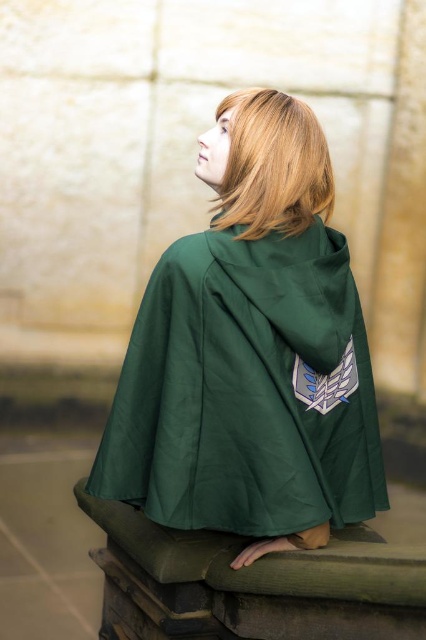
Between green fabric cape at center and blonde silky hair at upper center, which one appears on the left side from the viewer's perspective?

Positioned to the left is green fabric cape at center.

Does green fabric cape at center have a lesser height compared to blonde silky hair at upper center?

No, green fabric cape at center is not shorter than blonde silky hair at upper center.

Does point (278, 237) come in front of point (293, 104)?

Yes, point (278, 237) is in front of point (293, 104).

At what (x,y) coordinates should I click in order to perform the action: click on green fabric cape at center. Please return your answer as a coordinate pair (x, y). Looking at the image, I should click on (250, 353).